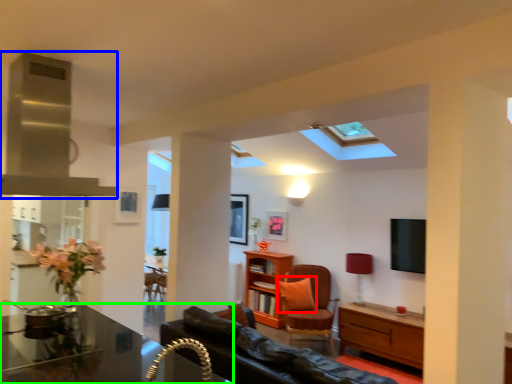
Question: Which object is the farthest from pillow (highlighted by a red box)? Choose among these: exhaust hood (highlighted by a blue box) or desk (highlighted by a green box).

Choices:
 (A) exhaust hood
 (B) desk

Answer: (A)